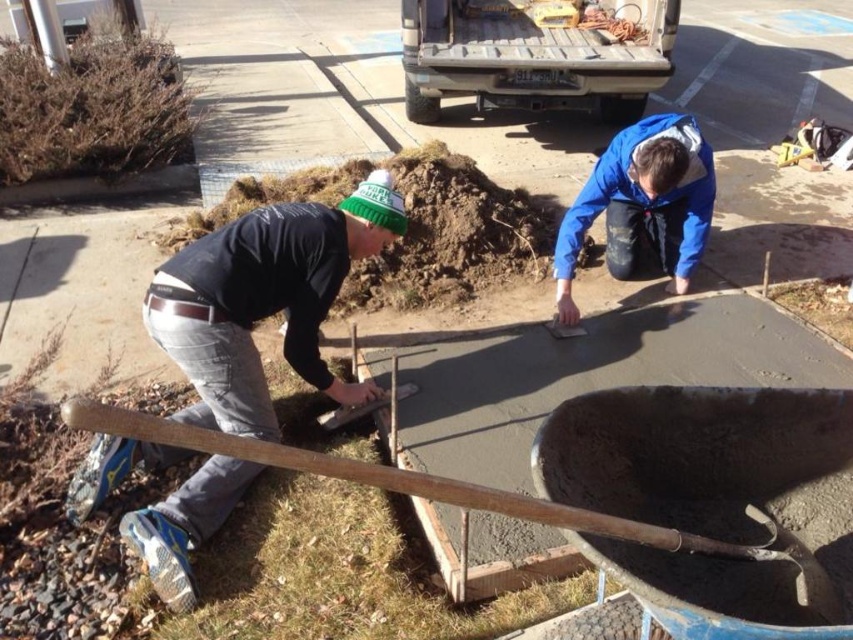
Question: Is blue matte jacket at center further to the viewer compared to wooden shovel at lower left?

Choices:
 (A) no
 (B) yes

Answer: (B)

Question: Which object appears farthest from the camera in this image?

Choices:
 (A) dark gray jeans at lower left
 (B) wooden shovel at lower left
 (C) blue matte jacket at center

Answer: (C)

Question: Among these objects, which one is farthest from the camera?

Choices:
 (A) dark gray jeans at lower left
 (B) wooden shovel at lower left

Answer: (A)

Question: Does dark gray jeans at lower left come in front of blue matte jacket at center?

Choices:
 (A) yes
 (B) no

Answer: (A)

Question: Which of the following is the farthest from the observer?

Choices:
 (A) (428, 492)
 (B) (618, 241)

Answer: (B)

Question: Does dark gray jeans at lower left have a greater width compared to wooden shovel at lower left?

Choices:
 (A) yes
 (B) no

Answer: (B)